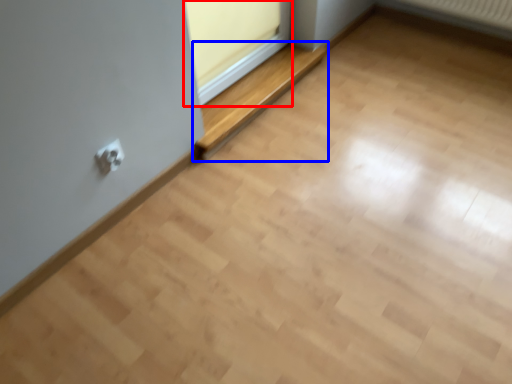
Question: Which point is further to the camera, window frame (highlighted by a red box) or balustrade (highlighted by a blue box)?

Choices:
 (A) window frame
 (B) balustrade

Answer: (B)